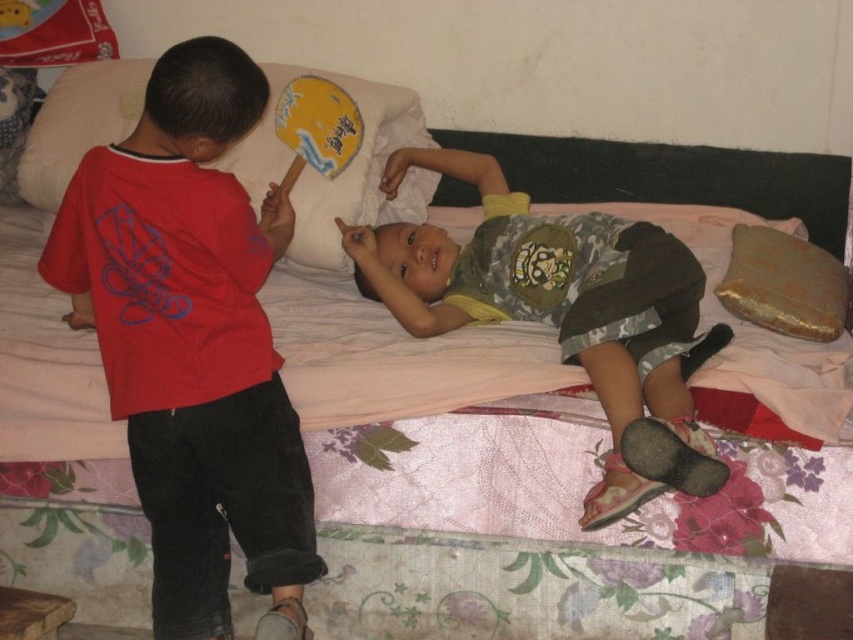
Question: Does gold textured pillow at right appear over yellow paper fan at upper center?

Choices:
 (A) no
 (B) yes

Answer: (A)

Question: Which point appears farthest from the camera in this image?

Choices:
 (A) (114, 84)
 (B) (193, 472)
 (C) (651, 403)
 (D) (776, 316)

Answer: (A)

Question: Based on their relative distances, which object is nearer to the yellow fabric pillow at upper left?

Choices:
 (A) matte red shirt at left
 (B) yellow paper fan at upper center
 (C) gold textured pillow at right
 (D) camouflage fabric shirt at center

Answer: (B)

Question: Is camouflage fabric shirt at center to the right of gold textured pillow at right from the viewer's perspective?

Choices:
 (A) yes
 (B) no

Answer: (B)

Question: Estimate the real-world distances between objects in this image. Which object is farther from the gold textured pillow at right?

Choices:
 (A) yellow fabric pillow at upper left
 (B) yellow paper fan at upper center
 (C) matte red shirt at left
 (D) camouflage fabric shirt at center

Answer: (C)

Question: Can you confirm if gold textured pillow at right is positioned below yellow paper fan at upper center?

Choices:
 (A) yes
 (B) no

Answer: (A)